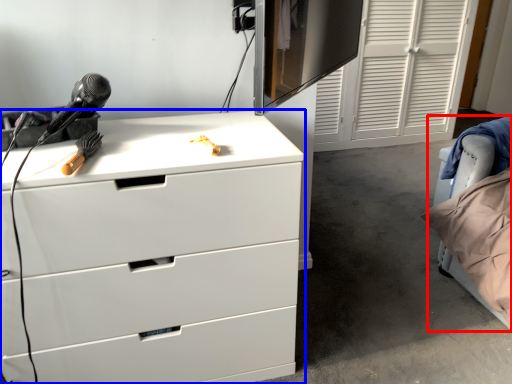
Question: Which object appears closest to the camera in this image, bed (highlighted by a red box) or chest of drawers (highlighted by a blue box)?

Choices:
 (A) bed
 (B) chest of drawers

Answer: (B)